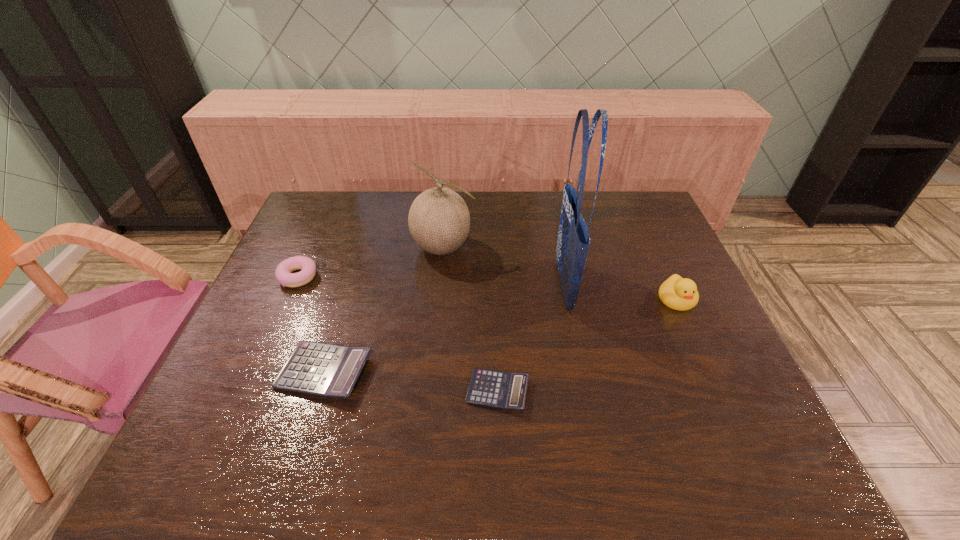
The height and width of the screenshot is (540, 960). I want to click on the taller calculator, so click(328, 370).

Where is `the left calculator`? The width and height of the screenshot is (960, 540). the left calculator is located at coordinates (328, 370).

What are the coordinates of `the shorter calculator` in the screenshot? It's located at (505, 390).

What are the coordinates of `the right calculator` in the screenshot? It's located at (505, 390).

I want to click on the fifth object from left to right, so click(573, 241).

Where is `shopping bag`? shopping bag is located at coordinates (573, 241).

Locate an element on the screen. doughnut is located at coordinates (283, 273).

Where is `cantaloup`? cantaloup is located at coordinates (439, 221).

The width and height of the screenshot is (960, 540). Find the location of `the rightmost object`. the rightmost object is located at coordinates (677, 293).

Where is `the fourth shortest object`? This screenshot has height=540, width=960. the fourth shortest object is located at coordinates (677, 293).